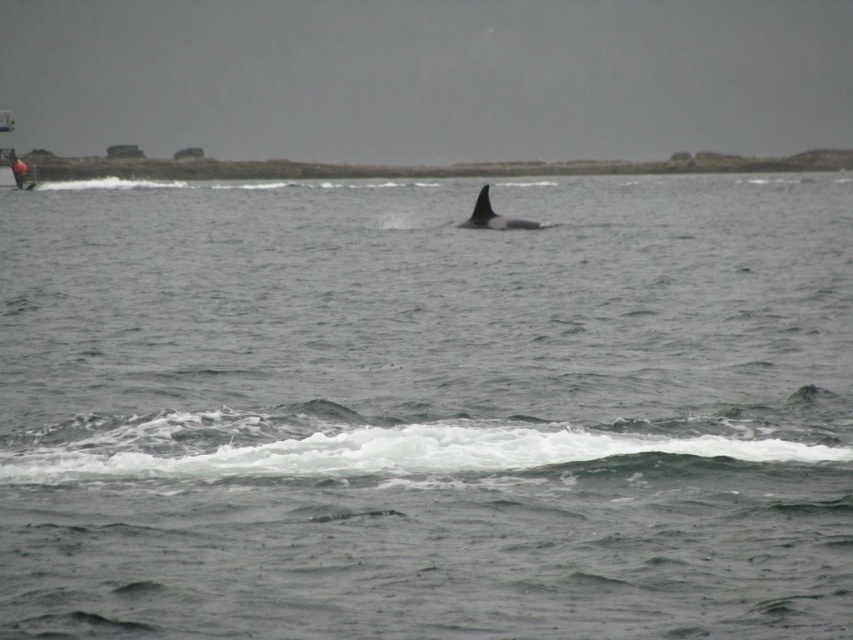
Question: Which object is closer to the camera taking this photo?

Choices:
 (A) gray matte water at center
 (B) black smooth whale at center

Answer: (A)

Question: Is gray matte water at center closer to camera compared to black smooth whale at center?

Choices:
 (A) yes
 (B) no

Answer: (A)

Question: Where is gray matte water at center located in relation to black smooth whale at center in the image?

Choices:
 (A) right
 (B) left

Answer: (A)

Question: Is gray matte water at center below black smooth whale at center?

Choices:
 (A) no
 (B) yes

Answer: (A)

Question: Among these points, which one is nearest to the camera?

Choices:
 (A) (479, 220)
 (B) (590, 228)

Answer: (A)